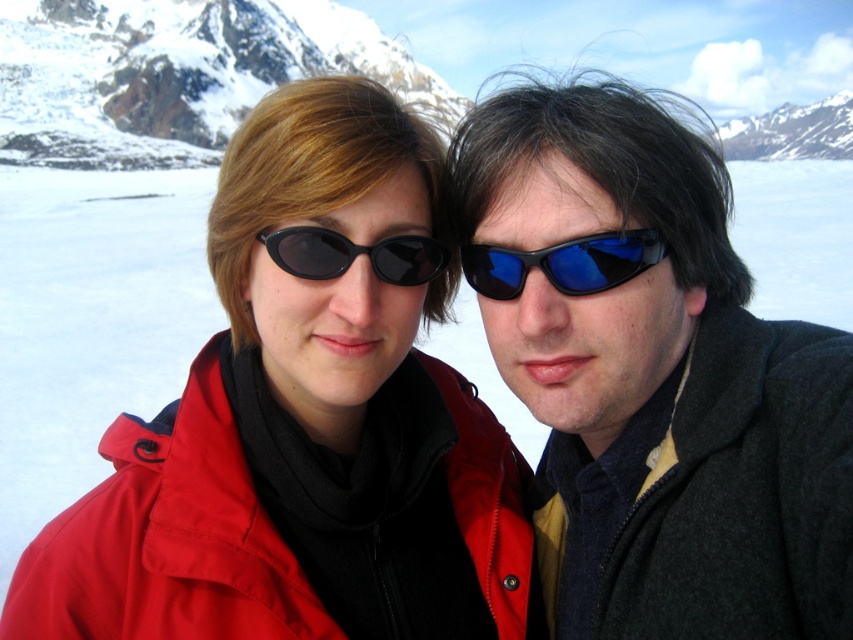
Question: Among these objects, which one is nearest to the camera?

Choices:
 (A) blue reflective plastic sunglasses at center
 (B) dark gray woolen jacket at right
 (C) snowy rock mountain at upper right

Answer: (B)

Question: Which point is farther from the camera taking this photo?

Choices:
 (A) (521, 148)
 (B) (421, 262)

Answer: (B)

Question: Which of the following is the farthest from the observer?

Choices:
 (A) black matte sunglasses at center
 (B) dark gray woolen jacket at right
 (C) snowy rock mountain at upper right

Answer: (C)

Question: Is matte black jacket at right to the right of black matte sunglasses at center from the viewer's perspective?

Choices:
 (A) yes
 (B) no

Answer: (A)

Question: Can you confirm if matte red jacket at center is positioned to the left of snowy granite mountain at upper left?

Choices:
 (A) no
 (B) yes

Answer: (A)

Question: Does snowy granite mountain at upper left appear on the right side of snowy rock mountain at upper right?

Choices:
 (A) yes
 (B) no

Answer: (B)